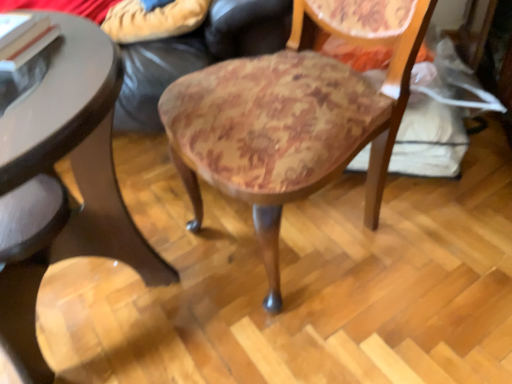
The height and width of the screenshot is (384, 512). What are the coordinates of `free region under wooden upholstered chair at center (from a real-world perspective)` in the screenshot? It's located at (291, 233).